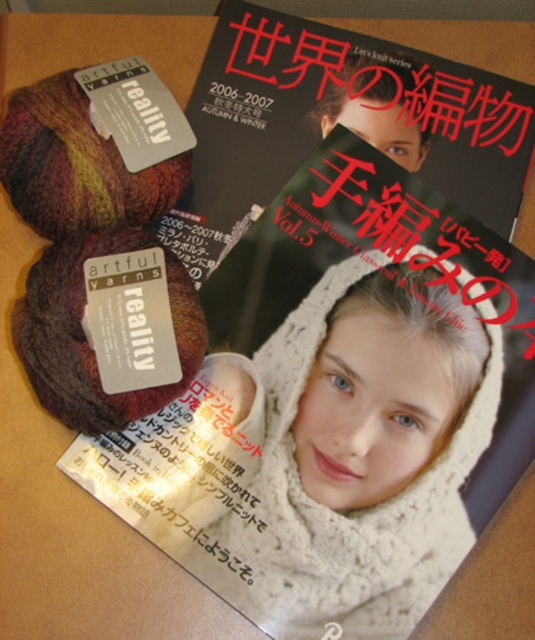
Image resolution: width=535 pixels, height=640 pixels. What do you see at coordinates (361, 456) in the screenshot? I see `white knitted scarf at center` at bounding box center [361, 456].

Describe the element at coordinates (361, 456) in the screenshot. This screenshot has width=535, height=640. I see `white knitted scarf at center` at that location.

Locate an element on the screen. The height and width of the screenshot is (640, 535). white knitted scarf at center is located at coordinates (361, 456).